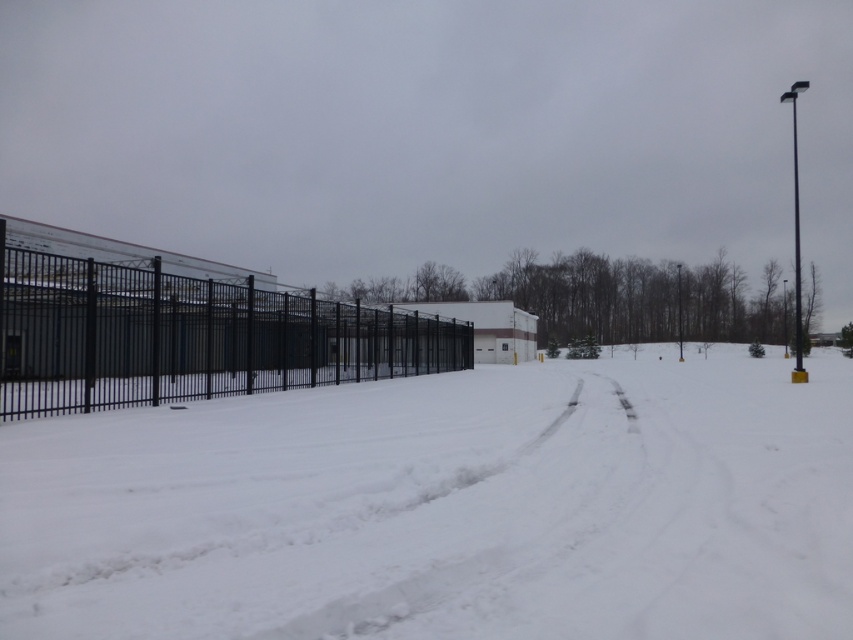
Question: Considering the relative positions of white powdery snow at center and black metal fence at left in the image provided, where is white powdery snow at center located with respect to black metal fence at left?

Choices:
 (A) below
 (B) above

Answer: (A)

Question: Does white powdery snow at center have a smaller size compared to black metal fence at left?

Choices:
 (A) no
 (B) yes

Answer: (B)

Question: Is white powdery snow at center smaller than black metal fence at left?

Choices:
 (A) no
 (B) yes

Answer: (B)

Question: Among these objects, which one is farthest from the camera?

Choices:
 (A) white powdery snow at center
 (B) black metal fence at left

Answer: (B)